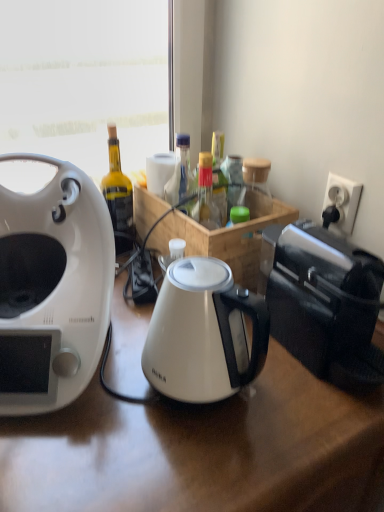
Question: Considering the relative sizes of white glossy electric kettle at center and white glossy coffee maker at left in the image provided, is white glossy electric kettle at center bigger than white glossy coffee maker at left?

Choices:
 (A) no
 (B) yes

Answer: (A)

Question: Considering the relative sizes of white glossy electric kettle at center and white glossy coffee maker at left in the image provided, is white glossy electric kettle at center smaller than white glossy coffee maker at left?

Choices:
 (A) no
 (B) yes

Answer: (B)

Question: Is white glossy electric kettle at center surrounding white glossy coffee maker at left?

Choices:
 (A) yes
 (B) no

Answer: (B)

Question: Can you confirm if white glossy electric kettle at center is shorter than white glossy coffee maker at left?

Choices:
 (A) yes
 (B) no

Answer: (A)

Question: From the image's perspective, is white glossy electric kettle at center over white glossy coffee maker at left?

Choices:
 (A) yes
 (B) no

Answer: (B)

Question: From their relative heights in the image, would you say white glossy coffee maker at left is taller or shorter than black plastic toaster at right?

Choices:
 (A) short
 (B) tall

Answer: (B)

Question: Choose the correct answer: Is white glossy coffee maker at left inside black plastic toaster at right or outside it?

Choices:
 (A) inside
 (B) outside

Answer: (B)

Question: From the image's perspective, relative to black plastic toaster at right, is white glossy coffee maker at left above or below?

Choices:
 (A) above
 (B) below

Answer: (A)

Question: In the image, is white glossy coffee maker at left positioned in front of or behind black plastic toaster at right?

Choices:
 (A) front
 (B) behind

Answer: (A)

Question: Relative to white glossy electric kettle at center, is white glossy coffee maker at left in front or behind?

Choices:
 (A) behind
 (B) front

Answer: (B)

Question: Based on their sizes in the image, would you say white glossy coffee maker at left is bigger or smaller than white glossy electric kettle at center?

Choices:
 (A) big
 (B) small

Answer: (A)

Question: Is white glossy coffee maker at left inside or outside of white glossy electric kettle at center?

Choices:
 (A) outside
 (B) inside

Answer: (A)

Question: From their relative heights in the image, would you say white glossy coffee maker at left is taller or shorter than white glossy electric kettle at center?

Choices:
 (A) short
 (B) tall

Answer: (B)

Question: Is point (220, 217) positioned closer to the camera than point (228, 305)?

Choices:
 (A) farther
 (B) closer

Answer: (A)

Question: Is translucent glass bottle at center situated inside white glossy electric kettle at center or outside?

Choices:
 (A) outside
 (B) inside

Answer: (A)